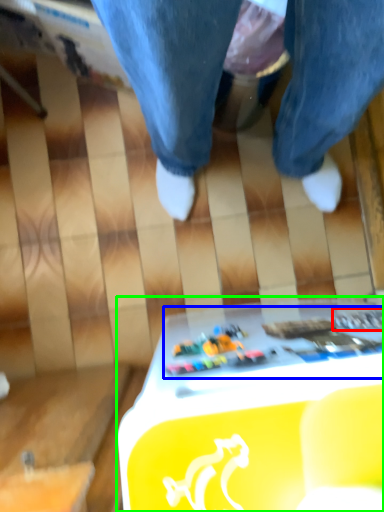
Question: Which object is the farthest from writing (highlighted by a red box)? Choose among these: writing (highlighted by a blue box) or table (highlighted by a green box).

Choices:
 (A) writing
 (B) table

Answer: (B)